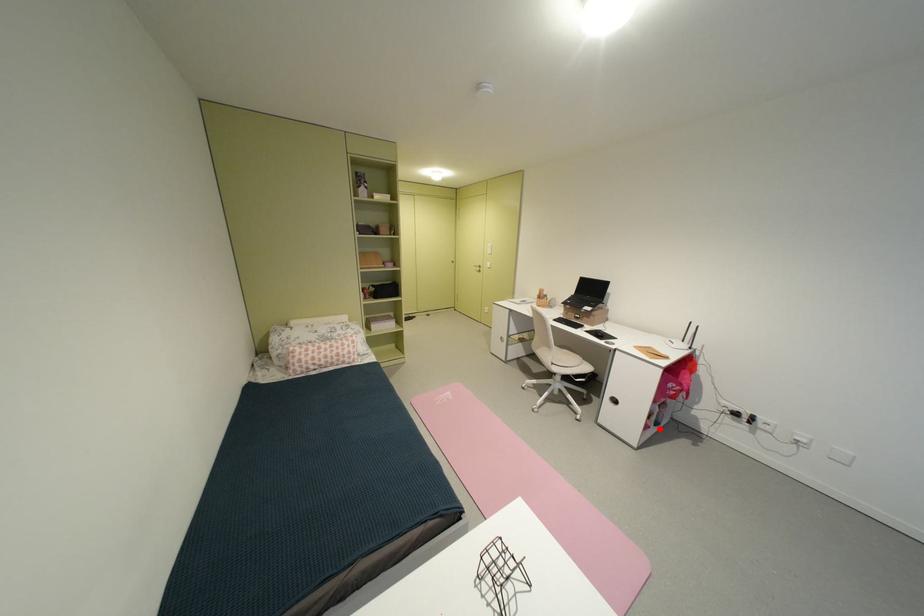
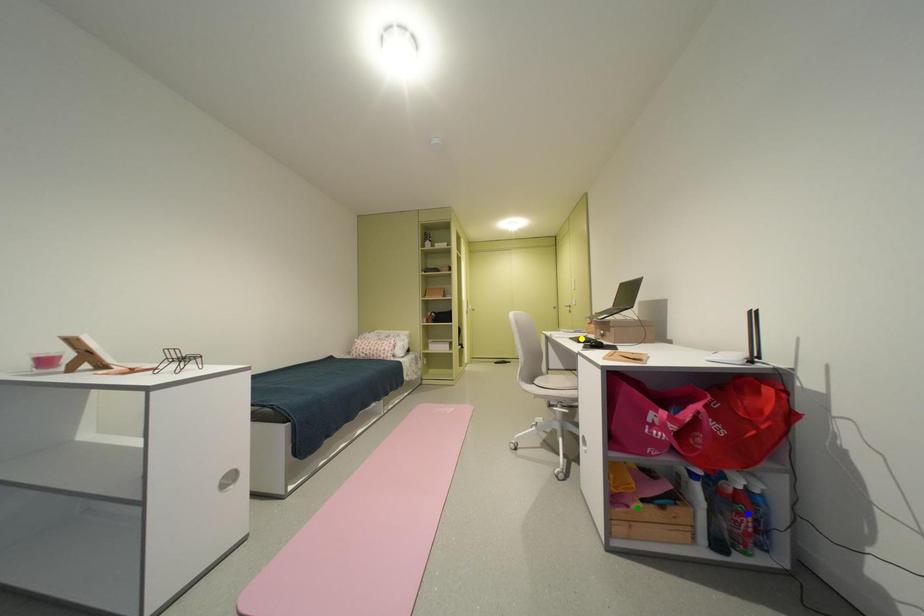
Question: I am providing you with two images of the same scene from different viewpoints. A red point is marked on the first image. You are given multiple points on the second image. Which mark in image 2 goes with the point in image 1?

Choices:
 (A) green point
 (B) blue point
 (C) yellow point

Answer: (A)